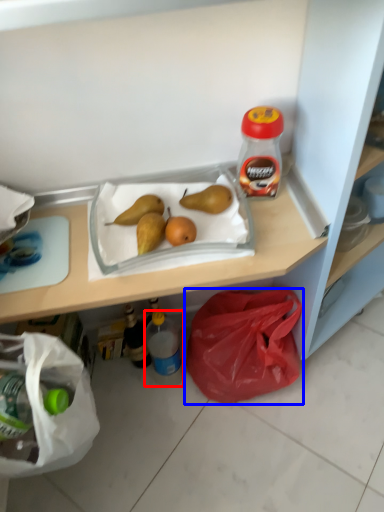
Question: Which of the following is the farthest to the observer, bottle (highlighted by a red box) or plastic bag (highlighted by a blue box)?

Choices:
 (A) bottle
 (B) plastic bag

Answer: (A)